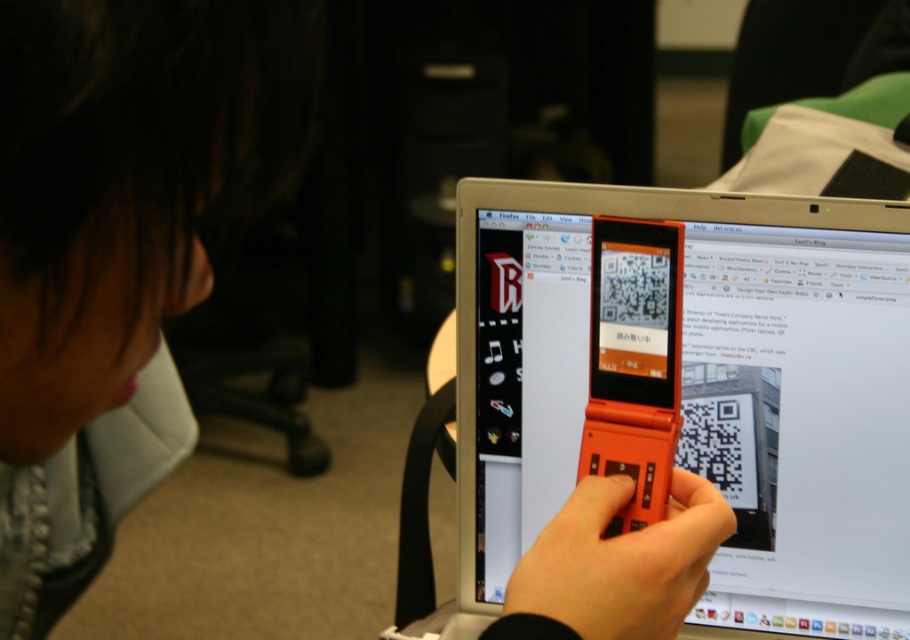
Question: Which point is closer to the camera taking this photo?

Choices:
 (A) (610, 452)
 (B) (582, 582)
 (C) (857, 442)

Answer: (B)

Question: Which object is positioned farthest from the orange matte flip phone at center?

Choices:
 (A) matte plastic screen at center
 (B) orange matte phone at center

Answer: (A)

Question: Considering the real-world distances, which object is farthest from the matte plastic screen at center?

Choices:
 (A) orange matte flip phone at center
 (B) orange matte phone at center

Answer: (B)

Question: Can you confirm if matte plastic screen at center is positioned above orange matte phone at center?

Choices:
 (A) no
 (B) yes

Answer: (B)

Question: Can you confirm if matte plastic screen at center is smaller than orange matte phone at center?

Choices:
 (A) no
 (B) yes

Answer: (A)

Question: In this image, where is matte plastic screen at center located relative to orange matte flip phone at center?

Choices:
 (A) below
 (B) above

Answer: (A)